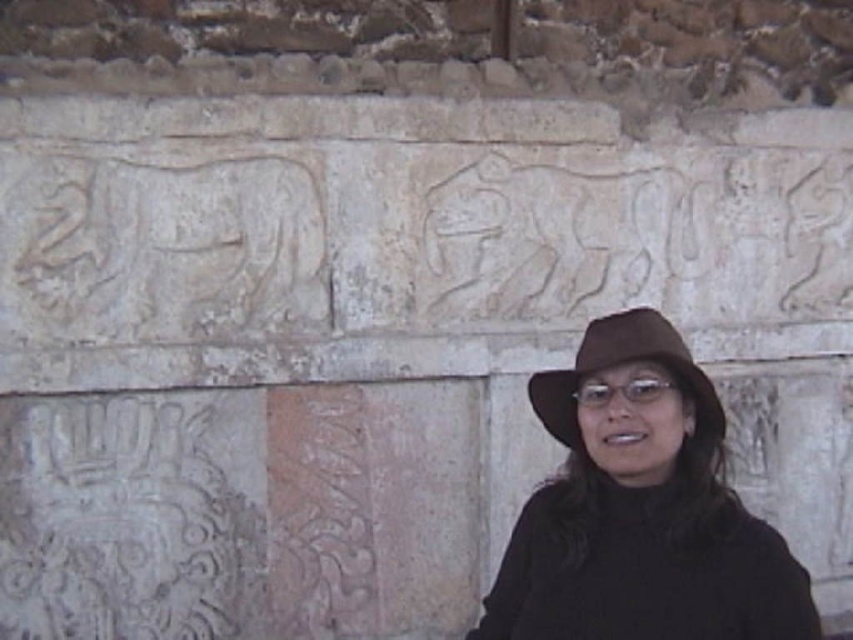
You are a photographer trying to capture the ancient stone wall with both the black felt hat at center and the brown felt fedora at center in your shot. Which hat should you focus on first if you want to ensure both are in frame and properly aligned?

The black felt hat at center is located below the brown felt fedora at center. To ensure both are in frame and properly aligned, focus on the brown felt fedora at center first since it is higher up, then adjust the camera angle downward to include the black felt hat at center below it.